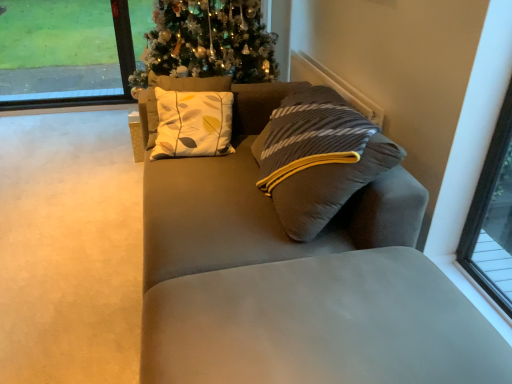
Question: From a real-world perspective, is transparent glass window at upper left on top of suede gray couch at center?

Choices:
 (A) no
 (B) yes

Answer: (B)

Question: Is transparent glass window at upper left positioned before suede gray couch at center?

Choices:
 (A) yes
 (B) no

Answer: (B)

Question: Is transparent glass window at upper left at the right side of suede gray couch at center?

Choices:
 (A) no
 (B) yes

Answer: (A)

Question: Are transparent glass window at upper left and suede gray couch at center located far from each other?

Choices:
 (A) yes
 (B) no

Answer: (A)

Question: Does transparent glass window at upper left have a lesser height compared to suede gray couch at center?

Choices:
 (A) no
 (B) yes

Answer: (A)

Question: Is suede gray couch at center in front of or behind transparent glass window at upper left in the image?

Choices:
 (A) front
 (B) behind

Answer: (A)

Question: Visually, is suede gray couch at center positioned to the left or to the right of transparent glass window at upper left?

Choices:
 (A) left
 (B) right

Answer: (B)

Question: From their relative heights in the image, would you say suede gray couch at center is taller or shorter than transparent glass window at upper left?

Choices:
 (A) short
 (B) tall

Answer: (A)

Question: Is suede gray couch at center bigger or smaller than transparent glass window at upper left?

Choices:
 (A) small
 (B) big

Answer: (B)

Question: Is suede gray couch at center in front of or behind beige carpet at lower left in the image?

Choices:
 (A) front
 (B) behind

Answer: (B)

Question: In the image, is suede gray couch at center on the left side or the right side of beige carpet at lower left?

Choices:
 (A) left
 (B) right

Answer: (B)

Question: In terms of width, does suede gray couch at center look wider or thinner when compared to beige carpet at lower left?

Choices:
 (A) wide
 (B) thin

Answer: (B)

Question: From a real-world perspective, is suede gray couch at center above or below beige carpet at lower left?

Choices:
 (A) below
 (B) above

Answer: (B)

Question: Relative to transparent glass window at upper left, is beige carpet at lower left in front or behind?

Choices:
 (A) behind
 (B) front

Answer: (B)

Question: Is beige carpet at lower left spatially inside transparent glass window at upper left, or outside of it?

Choices:
 (A) outside
 (B) inside

Answer: (A)